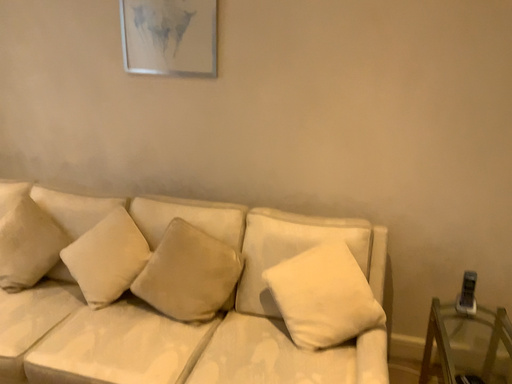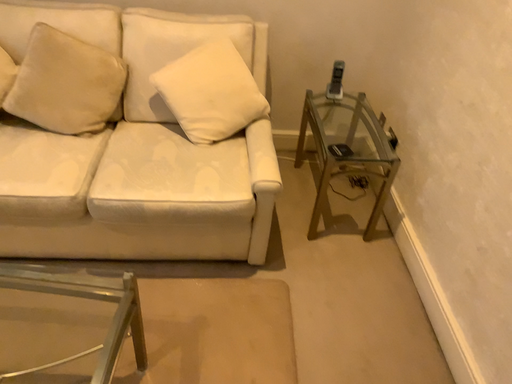
Question: How did the camera likely rotate when shooting the video?

Choices:
 (A) rotated right
 (B) rotated left

Answer: (A)